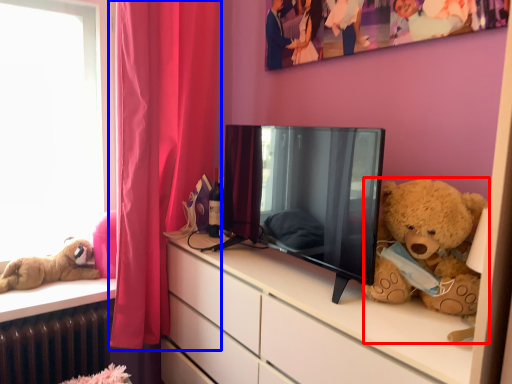
Question: Which point is further to the camera, teddy bear (highlighted by a red box) or curtain (highlighted by a blue box)?

Choices:
 (A) teddy bear
 (B) curtain

Answer: (B)